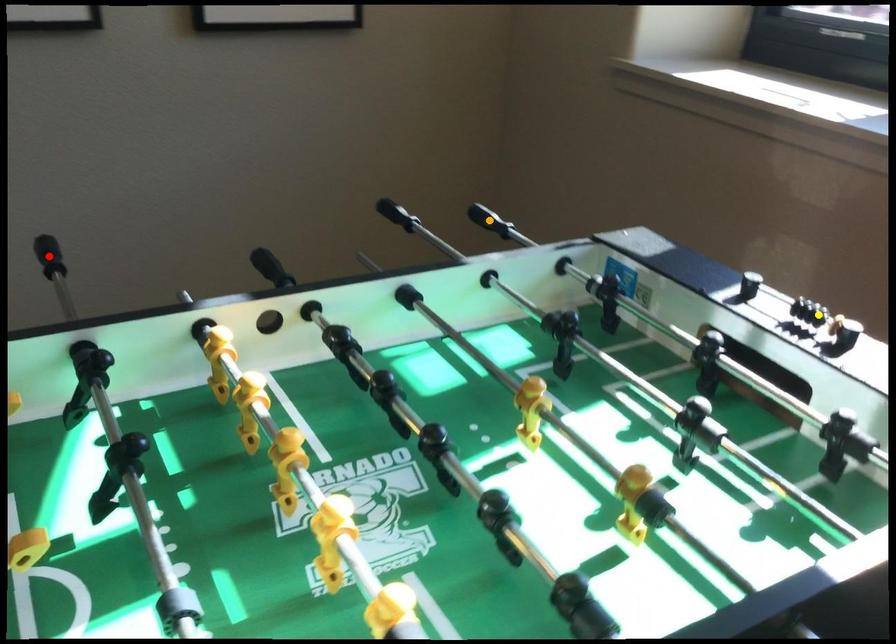
Order these from nearest to farthest:
yellow point | red point | orange point

yellow point → red point → orange point